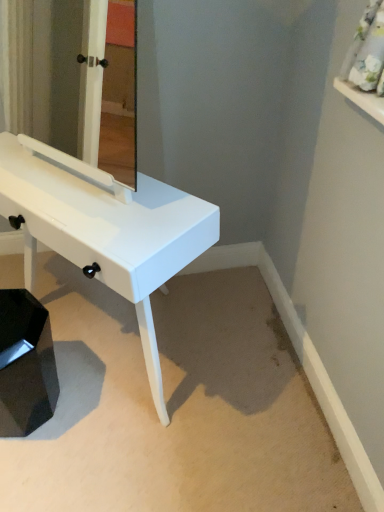
Question: Is there a large distance between white glossy mirror at center and black glossy step stool at lower left?

Choices:
 (A) no
 (B) yes

Answer: (B)

Question: From a real-world perspective, is white glossy mirror at center physically above black glossy step stool at lower left?

Choices:
 (A) yes
 (B) no

Answer: (A)

Question: From the image's perspective, does white glossy mirror at center appear lower than black glossy step stool at lower left?

Choices:
 (A) no
 (B) yes

Answer: (A)

Question: From the image's perspective, is white glossy mirror at center over black glossy step stool at lower left?

Choices:
 (A) no
 (B) yes

Answer: (B)

Question: Does white glossy mirror at center have a greater height compared to black glossy step stool at lower left?

Choices:
 (A) no
 (B) yes

Answer: (B)

Question: Considering the positions of black glossy step stool at lower left and white glossy mirror at center in the image, is black glossy step stool at lower left taller or shorter than white glossy mirror at center?

Choices:
 (A) tall
 (B) short

Answer: (B)

Question: Does point (3, 345) appear closer or farther from the camera than point (99, 108)?

Choices:
 (A) farther
 (B) closer

Answer: (B)

Question: From a real-world perspective, relative to white glossy mirror at center, is black glossy step stool at lower left vertically above or below?

Choices:
 (A) below
 (B) above

Answer: (A)

Question: Considering the positions of black glossy step stool at lower left and white glossy mirror at center in the image, is black glossy step stool at lower left wider or thinner than white glossy mirror at center?

Choices:
 (A) wide
 (B) thin

Answer: (A)

Question: From the image's perspective, relative to white glossy table at center, is black glossy step stool at lower left above or below?

Choices:
 (A) above
 (B) below

Answer: (B)

Question: Is point (38, 330) positioned closer to the camera than point (172, 197)?

Choices:
 (A) closer
 (B) farther

Answer: (B)

Question: Would you say black glossy step stool at lower left is to the left or to the right of white glossy table at center in the picture?

Choices:
 (A) left
 (B) right

Answer: (A)

Question: Is black glossy step stool at lower left wider or thinner than white glossy table at center?

Choices:
 (A) wide
 (B) thin

Answer: (B)

Question: Is point (59, 196) positioned closer to the camera than point (21, 9)?

Choices:
 (A) closer
 (B) farther

Answer: (A)

Question: Choose the correct answer: Is white glossy table at center inside white glossy mirror at center or outside it?

Choices:
 (A) inside
 (B) outside

Answer: (B)